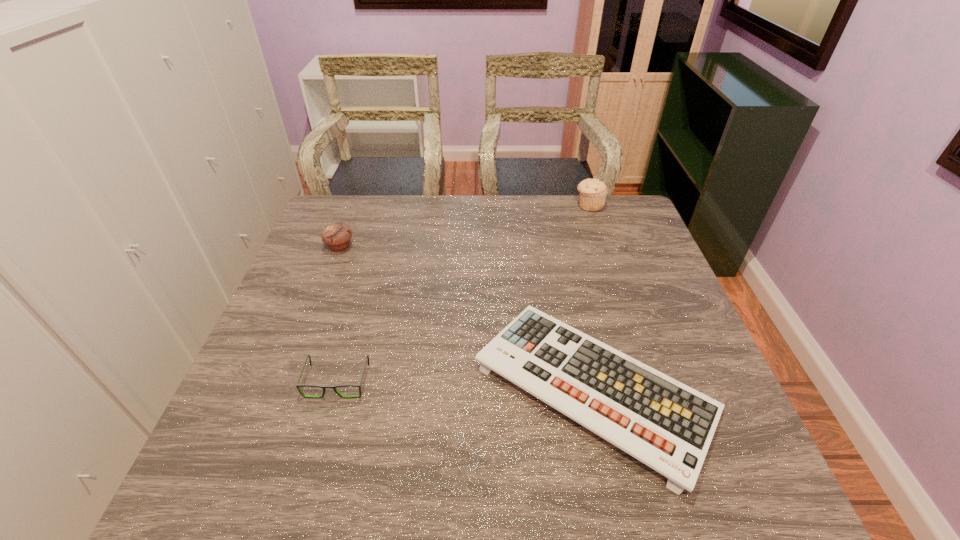
Find the location of a particular element. Image resolution: width=960 pixels, height=540 pixels. object located in the far edge section of the desktop is located at coordinates (593, 192).

I want to click on object present at the near edge, so click(667, 425).

Where is `muffin present at the left edge`? The height and width of the screenshot is (540, 960). muffin present at the left edge is located at coordinates [x=337, y=236].

At what (x,y) coordinates should I click in order to perform the action: click on spectacles situated at the left edge. Please return your answer as a coordinate pair (x, y). Looking at the image, I should click on (298, 385).

Where is `muffin at the right edge`? The image size is (960, 540). muffin at the right edge is located at coordinates (593, 192).

Identify the location of computer keyboard positioned at the right edge. (667, 425).

This screenshot has height=540, width=960. In order to click on object present at the far right corner in this screenshot , I will do `click(593, 192)`.

Image resolution: width=960 pixels, height=540 pixels. I want to click on object positioned at the near right corner, so click(x=667, y=425).

You are a GUI agent. You are given a task and a screenshot of the screen. Output one action in this format:
    pyautogui.click(x=<x>, y=<y>)
    Task: Click on the free space at the far edge of the desktop
    The image size is (960, 540).
    Given the screenshot: What is the action you would take?
    pyautogui.click(x=423, y=233)

In the image, there is a desktop. Find the location of `vacant space at the near edge`. vacant space at the near edge is located at coordinates (515, 493).